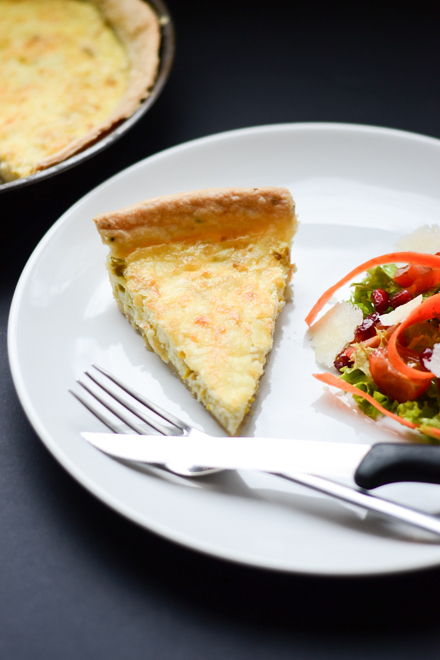
You are a GUI agent. You are given a task and a screenshot of the screen. Output one action in this format:
    pyautogui.click(x=<x>, y=<y>)
    Task: Click on the black handle
    This screenshot has width=440, height=660.
    Given the screenshot: What is the action you would take?
    pyautogui.click(x=391, y=457)